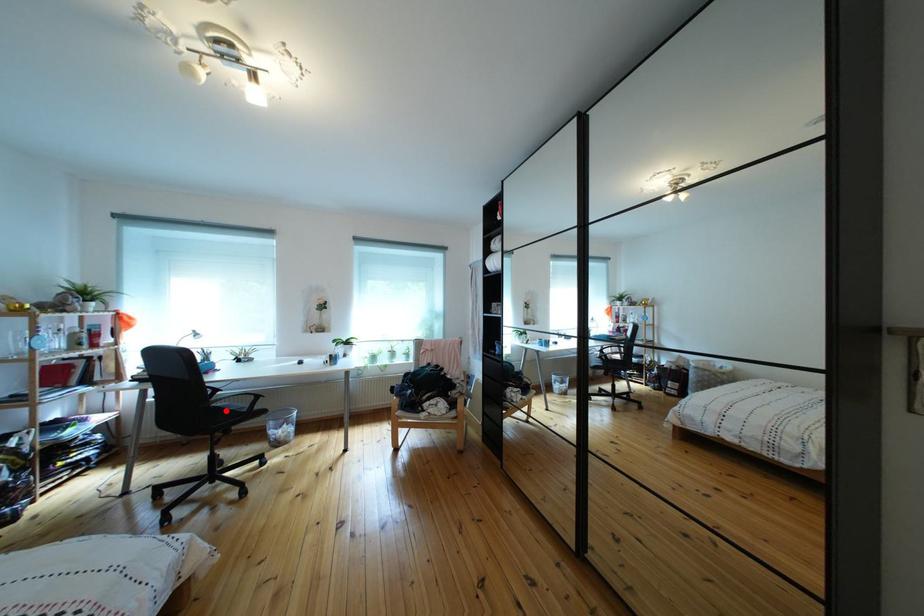
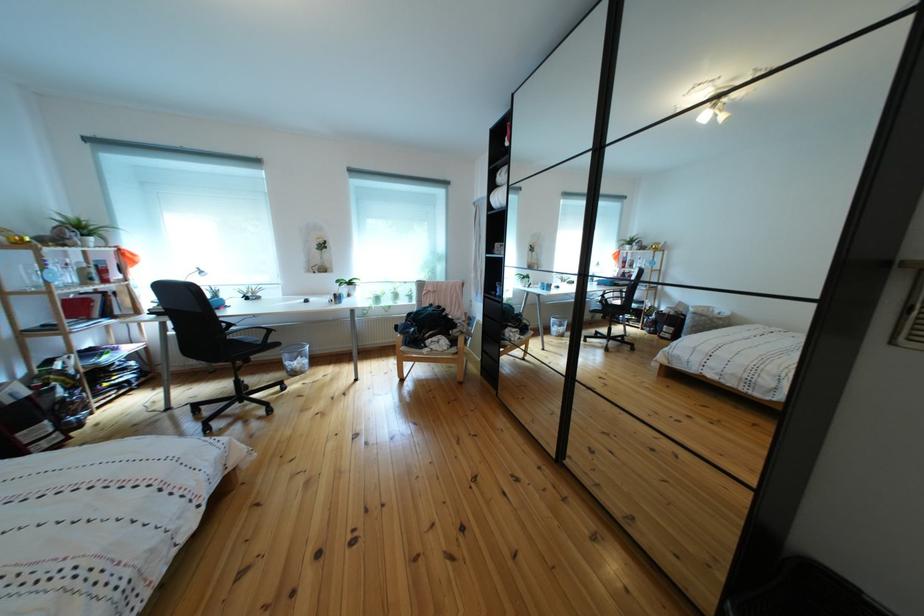
In the second image, find the point that corresponds to the highlighted location in the first image.

(241, 342)